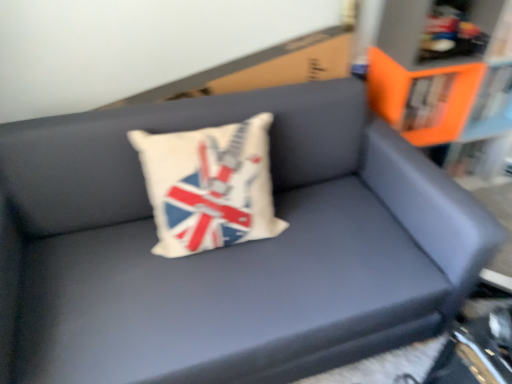
Question: Can you confirm if white fabric pillow at center is thinner than orange plastic bookcase at upper right?

Choices:
 (A) yes
 (B) no

Answer: (A)

Question: Considering the relative positions of white fabric pillow at center and orange plastic bookcase at upper right in the image provided, is white fabric pillow at center to the right of orange plastic bookcase at upper right from the viewer's perspective?

Choices:
 (A) yes
 (B) no

Answer: (B)

Question: Would you say orange plastic bookcase at upper right is part of white fabric pillow at center's contents?

Choices:
 (A) no
 (B) yes

Answer: (A)

Question: Does white fabric pillow at center have a greater width compared to orange plastic bookcase at upper right?

Choices:
 (A) no
 (B) yes

Answer: (A)

Question: Is the depth of white fabric pillow at center greater than that of orange plastic bookcase at upper right?

Choices:
 (A) yes
 (B) no

Answer: (B)

Question: From a real-world perspective, is white fabric pillow at center on top of orange plastic bookcase at upper right?

Choices:
 (A) yes
 (B) no

Answer: (A)

Question: Is orange plastic bookcase at upper right to the right of white fabric pillow at center from the viewer's perspective?

Choices:
 (A) no
 (B) yes

Answer: (B)

Question: Is the position of orange plastic bookcase at upper right less distant than that of white fabric pillow at center?

Choices:
 (A) yes
 (B) no

Answer: (B)

Question: Does orange plastic bookcase at upper right lie behind white fabric pillow at center?

Choices:
 (A) yes
 (B) no

Answer: (A)

Question: Does orange plastic bookcase at upper right have a smaller size compared to white fabric pillow at center?

Choices:
 (A) no
 (B) yes

Answer: (A)

Question: Is orange plastic bookcase at upper right wider than white fabric pillow at center?

Choices:
 (A) yes
 (B) no

Answer: (A)

Question: Are orange plastic bookcase at upper right and white fabric pillow at center beside each other?

Choices:
 (A) no
 (B) yes

Answer: (A)

Question: Considering the positions of white fabric pillow at center and orange plastic bookcase at upper right in the image, is white fabric pillow at center wider or thinner than orange plastic bookcase at upper right?

Choices:
 (A) wide
 (B) thin

Answer: (B)